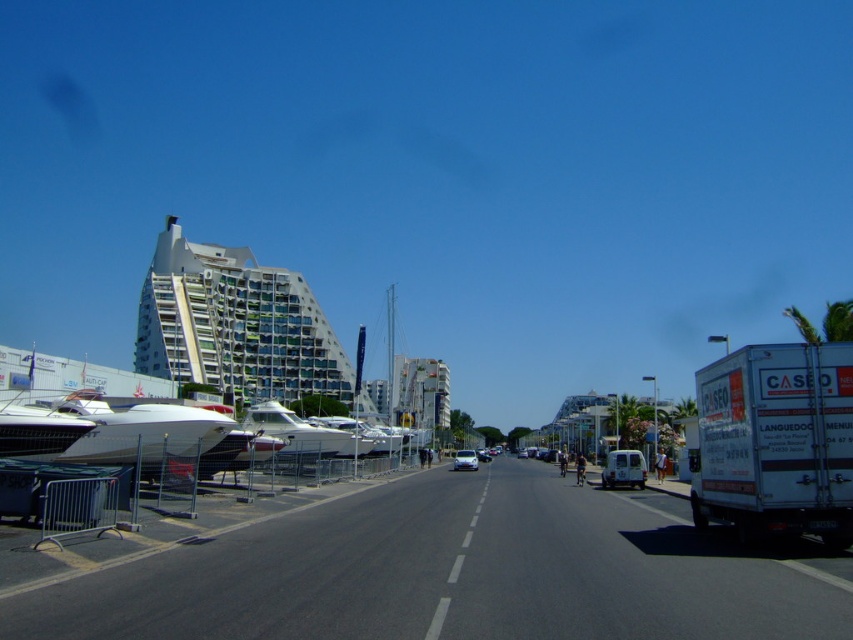
Question: Which is farther from the white glossy yacht at center?

Choices:
 (A) white glossy boat at left
 (B) silver metallic car at center
 (C) white glossy car at center
 (D) white glossy boat at center

Answer: (C)

Question: Is white glossy yacht at center to the left of silver metallic car at center from the viewer's perspective?

Choices:
 (A) yes
 (B) no

Answer: (A)

Question: Where is white glossy boat at center located in relation to white matte van at center in the image?

Choices:
 (A) left
 (B) right

Answer: (A)

Question: Which is farther from the white glossy boat at center?

Choices:
 (A) silver metallic car at center
 (B) white glossy yacht at center

Answer: (A)

Question: Is white glossy boat at left positioned behind white glossy car at center?

Choices:
 (A) yes
 (B) no

Answer: (B)

Question: Which object is closer to the camera taking this photo?

Choices:
 (A) white glossy car at center
 (B) white matte van at center
 (C) white glossy yacht at center
 (D) white glossy boat at center

Answer: (B)